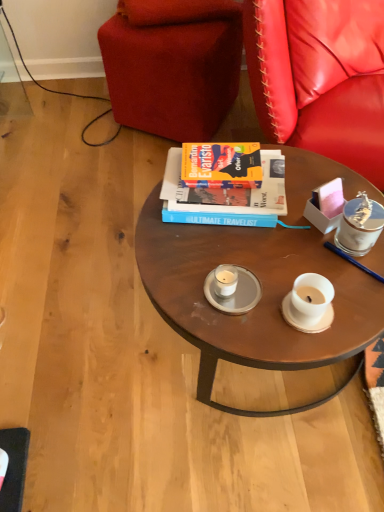
Identify the location of free space between silver metallic candle at upper right, acting as the second coffee cup starting from the bottom, and white matte candle at center, which is the second coffee cup from top to bottom. (295, 264).